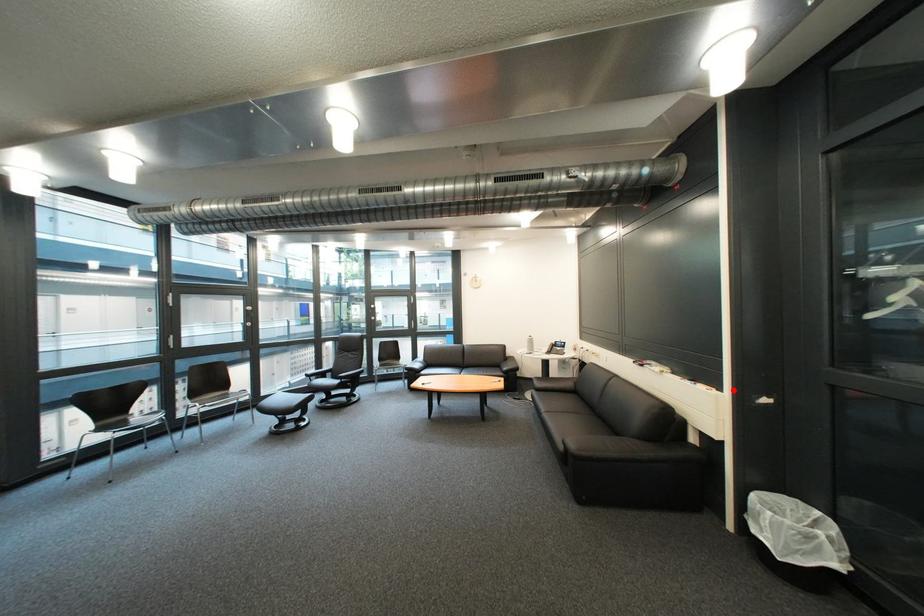
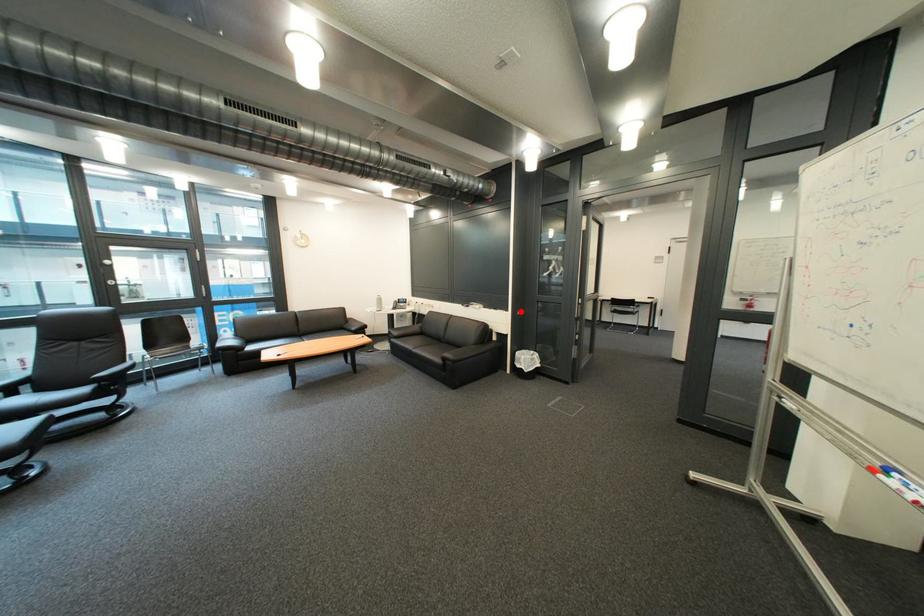
I am providing you with two images of the same scene from different viewpoints. A red point is marked on the first image and another point is marked on the second image. Do the highlighted points in image1 and image2 indicate the same real-world spot?

Yes